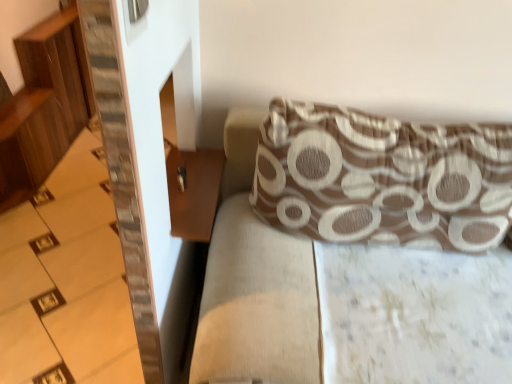
Question: From a real-world perspective, relative to wooden stairs at left, is brown wooden table at lower left vertically above or below?

Choices:
 (A) above
 (B) below

Answer: (A)

Question: From the image's perspective, relative to wooden stairs at left, is brown wooden table at lower left above or below?

Choices:
 (A) above
 (B) below

Answer: (A)

Question: Considering the real-world distances, which object is farthest from the brown textured pillow at upper right?

Choices:
 (A) brown textured cushion at upper right
 (B) wooden stairs at left
 (C) brown wooden table at lower left

Answer: (B)

Question: Based on their relative distances, which object is nearer to the brown textured cushion at upper right?

Choices:
 (A) brown wooden table at lower left
 (B) brown textured pillow at upper right
 (C) wooden stairs at left

Answer: (B)